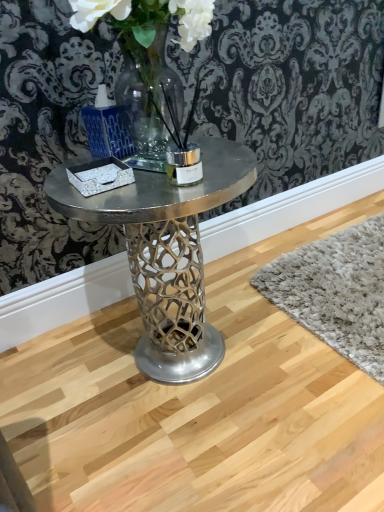
The width and height of the screenshot is (384, 512). In order to click on free space in front of metallic silver table at center in this screenshot , I will do `click(197, 462)`.